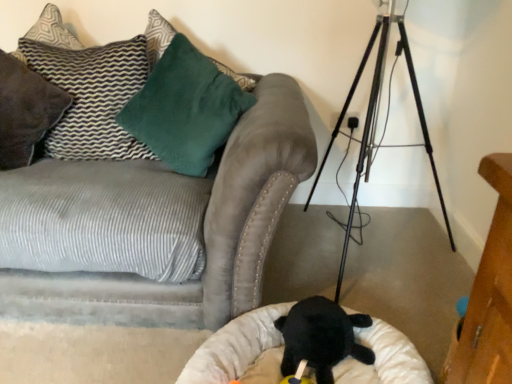
Question: Is white plush cat bed at lower center closer to camera compared to velvety green pillow at upper left, which is the second pillow from left to right?

Choices:
 (A) yes
 (B) no

Answer: (A)

Question: Does white plush cat bed at lower center have a greater height compared to velvety green pillow at upper left, which is the second pillow from left to right?

Choices:
 (A) no
 (B) yes

Answer: (A)

Question: Considering the relative sizes of white plush cat bed at lower center and velvety green pillow at upper left, which is the second pillow from left to right, in the image provided, is white plush cat bed at lower center wider than velvety green pillow at upper left, which is the second pillow from left to right,?

Choices:
 (A) no
 (B) yes

Answer: (B)

Question: Is white plush cat bed at lower center shorter than velvety green pillow at upper left, arranged as the 1th pillow when viewed from the right?

Choices:
 (A) no
 (B) yes

Answer: (B)

Question: Is white plush cat bed at lower center thinner than velvety green pillow at upper left, which is the second pillow from left to right?

Choices:
 (A) no
 (B) yes

Answer: (A)

Question: From a real-world perspective, is textured gray pillow at upper left, positioned as the second pillow in right-to-left order, physically located above or below white plush cat bed at lower center?

Choices:
 (A) above
 (B) below

Answer: (A)

Question: Is textured gray pillow at upper left, which is the first pillow from left to right, in front of or behind white plush cat bed at lower center in the image?

Choices:
 (A) front
 (B) behind

Answer: (B)

Question: Is textured gray pillow at upper left, positioned as the second pillow in right-to-left order, spatially inside white plush cat bed at lower center, or outside of it?

Choices:
 (A) outside
 (B) inside

Answer: (A)

Question: In terms of width, does textured gray pillow at upper left, positioned as the second pillow in right-to-left order, look wider or thinner when compared to white plush cat bed at lower center?

Choices:
 (A) wide
 (B) thin

Answer: (B)

Question: Looking at the image, does soft plush toy at center seem bigger or smaller compared to textured gray pillow at upper left, which is the first pillow from left to right?

Choices:
 (A) big
 (B) small

Answer: (B)

Question: Is soft plush toy at center in front of or behind textured gray pillow at upper left, which is the first pillow from left to right, in the image?

Choices:
 (A) behind
 (B) front

Answer: (B)

Question: Does point (306, 377) appear closer or farther from the camera than point (117, 61)?

Choices:
 (A) closer
 (B) farther

Answer: (A)

Question: Choose the correct answer: Is soft plush toy at center inside textured gray pillow at upper left, positioned as the second pillow in right-to-left order, or outside it?

Choices:
 (A) inside
 (B) outside

Answer: (B)

Question: Is white plush cat bed at lower center wider or thinner than textured gray pillow at upper left, which is the first pillow from left to right?

Choices:
 (A) thin
 (B) wide

Answer: (B)

Question: From the image's perspective, is white plush cat bed at lower center positioned above or below textured gray pillow at upper left, positioned as the second pillow in right-to-left order?

Choices:
 (A) above
 (B) below

Answer: (B)